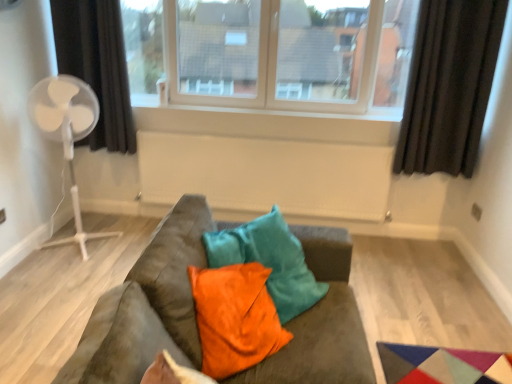
What are the coordinates of `white matte radiator at center` in the screenshot? It's located at (267, 174).

This screenshot has height=384, width=512. In order to click on suede-like brown couch at center in this screenshot , I will do `click(147, 306)`.

Measure the distance between point (130, 296) and camera.

The distance of point (130, 296) from camera is 4.16 feet.

Describe the element at coordinates (97, 66) in the screenshot. I see `black fabric curtain at left, positioned as the 2th curtain in right-to-left order` at that location.

You are a GUI agent. You are given a task and a screenshot of the screen. Output one action in this format:
    pyautogui.click(x=<x>, y=<y>)
    Task: Click on the white plastic window sill at upper center
    The height and width of the screenshot is (384, 512).
    Given the screenshot: What is the action you would take?
    pyautogui.click(x=265, y=123)

Locate an element on the screen. white matte radiator at center is located at coordinates (267, 174).

Considering the sizes of objects black fabric curtain at left, placed as the 1th curtain when sorted from left to right, and suede-like brown couch at center in the image provided, who is smaller, black fabric curtain at left, placed as the 1th curtain when sorted from left to right, or suede-like brown couch at center?

black fabric curtain at left, placed as the 1th curtain when sorted from left to right, is smaller.

Are black fabric curtain at left, placed as the 1th curtain when sorted from left to right, and suede-like brown couch at center making contact?

No, black fabric curtain at left, placed as the 1th curtain when sorted from left to right, is not touching suede-like brown couch at center.

From a real-world perspective, who is located lower, black fabric curtain at left, positioned as the 2th curtain in right-to-left order, or suede-like brown couch at center?

suede-like brown couch at center, from a real-world perspective.

Is black fabric curtain at right, the 1th curtain from the right, inside or outside of orange velvet pillow at center?

black fabric curtain at right, the 1th curtain from the right, is outside orange velvet pillow at center.

Which is closer to the camera, [440,159] or [277,332]?

Point [440,159] is farther from the camera than point [277,332].

Is black fabric curtain at right, the 1th curtain from the right, touching orange velvet pillow at center?

No, black fabric curtain at right, the 1th curtain from the right, is not with orange velvet pillow at center.

Is black fabric curtain at right, the 1th curtain from the right, wider or thinner than orange velvet pillow at center?

Clearly, black fabric curtain at right, the 1th curtain from the right, has less width compared to orange velvet pillow at center.

Is the depth of white matte radiator at center less than that of white plastic fan at left?

No, the depth of white matte radiator at center is greater than that of white plastic fan at left.

Is white matte radiator at center next to white plastic fan at left and touching it?

No.

Is white matte radiator at center aimed at white plastic fan at left?

No, white matte radiator at center is not oriented towards white plastic fan at left.

How different are the orientations of white matte radiator at center and white plastic fan at left in degrees?

white matte radiator at center and white plastic fan at left are facing 0.765 degrees away from each other.

Is white plastic fan at left located outside transparent glass window at center?

Absolutely, white plastic fan at left is external to transparent glass window at center.

Is white plastic fan at left looking in the opposite direction of transparent glass window at center?

No, white plastic fan at left is not facing the opposite direction of transparent glass window at center.

Can you confirm if white plastic fan at left is positioned to the left of transparent glass window at center?

Yes, white plastic fan at left is to the left of transparent glass window at center.

From the picture: Considering the sizes of white plastic fan at left and transparent glass window at center in the image, is white plastic fan at left taller or shorter than transparent glass window at center?

white plastic fan at left is taller than transparent glass window at center.

Is white matte radiator at center far away from black fabric curtain at right, marked as the 2th curtain in a left-to-right arrangement?

That's not correct — white matte radiator at center is a little close to black fabric curtain at right, marked as the 2th curtain in a left-to-right arrangement.

Image resolution: width=512 pixels, height=384 pixels. In order to click on the 2nd curtain in front of the white matte radiator at center, starting your count from the anchor in this screenshot , I will do (x=449, y=86).

Measure the distance between white matte radiator at center and black fabric curtain at right, the 1th curtain from the right.

31.02 inches.

Does white matte radiator at center have a lesser height compared to black fabric curtain at right, the 1th curtain from the right?

Yes.

Which object is more forward, orange velvet pillow at center or white matte radiator at center?

orange velvet pillow at center is more forward.

Can you confirm if orange velvet pillow at center is bigger than white matte radiator at center?

Actually, orange velvet pillow at center might be smaller than white matte radiator at center.

Are orange velvet pillow at center and white matte radiator at center beside each other?

No, orange velvet pillow at center is not next to white matte radiator at center.

Is transparent glass window at center with black fabric curtain at left, positioned as the 2th curtain in right-to-left order?

transparent glass window at center and black fabric curtain at left, positioned as the 2th curtain in right-to-left order, are not in contact.

Looking at the image, does transparent glass window at center seem bigger or smaller compared to black fabric curtain at left, positioned as the 2th curtain in right-to-left order?

transparent glass window at center is bigger than black fabric curtain at left, positioned as the 2th curtain in right-to-left order.

Is transparent glass window at center situated inside black fabric curtain at left, placed as the 1th curtain when sorted from left to right, or outside?

transparent glass window at center is not inside black fabric curtain at left, placed as the 1th curtain when sorted from left to right, it's outside.

Find the location of `studio couch lying on the right of black fabric curtain at left, placed as the 1th curtain when sorted from left to right`. studio couch lying on the right of black fabric curtain at left, placed as the 1th curtain when sorted from left to right is located at coordinates (147, 306).

Which curtain is the 1st one when counting from the back of the orange velvet pillow at center? Please provide its 2D coordinates.

[(449, 86)]

Considering their positions, is white plastic window sill at upper center positioned further to suede-like brown couch at center than black fabric curtain at right, the 1th curtain from the right?

white plastic window sill at upper center is further to suede-like brown couch at center.

Estimate the real-world distances between objects in this image. Which object is closer to orange velvet pillow at center, white plastic window sill at upper center or white plastic fan at left?

white plastic fan at left.

Estimate the real-world distances between objects in this image. Which object is further from suede-like brown couch at center, transparent glass window at center or black fabric curtain at left, positioned as the 2th curtain in right-to-left order?

black fabric curtain at left, positioned as the 2th curtain in right-to-left order, lies further to suede-like brown couch at center than the other object.

Consider the image. Based on their spatial positions, is white matte radiator at center or black fabric curtain at left, placed as the 1th curtain when sorted from left to right, closer to white plastic fan at left?

black fabric curtain at left, placed as the 1th curtain when sorted from left to right, is closer to white plastic fan at left.

Estimate the real-world distances between objects in this image. Which object is closer to transparent glass window at center, white plastic fan at left or black fabric curtain at right, the 1th curtain from the right?

black fabric curtain at right, the 1th curtain from the right, is positioned closer to the anchor transparent glass window at center.

Based on their spatial positions, is white plastic window sill at upper center or white matte radiator at center closer to white plastic fan at left?

Among the two, white plastic window sill at upper center is located nearer to white plastic fan at left.

From the image, which object appears to be farther from black fabric curtain at left, placed as the 1th curtain when sorted from left to right, black fabric curtain at right, marked as the 2th curtain in a left-to-right arrangement, or white plastic window sill at upper center?

Based on the image, black fabric curtain at right, marked as the 2th curtain in a left-to-right arrangement, appears to be further to black fabric curtain at left, placed as the 1th curtain when sorted from left to right.

Based on their spatial positions, is white matte radiator at center or black fabric curtain at left, positioned as the 2th curtain in right-to-left order, closer to black fabric curtain at right, the 1th curtain from the right?

white matte radiator at center.

Find the location of a particular element. The width and height of the screenshot is (512, 384). fan between suede-like brown couch at center and transparent glass window at center from front to back is located at coordinates (66, 133).

The height and width of the screenshot is (384, 512). In order to click on radiator between white plastic fan at left and black fabric curtain at right, marked as the 2th curtain in a left-to-right arrangement, from left to right in this screenshot , I will do [x=267, y=174].

Find the location of a particular element. The height and width of the screenshot is (384, 512). radiator located between suede-like brown couch at center and white plastic window sill at upper center in the depth direction is located at coordinates (267, 174).

Locate an element on the screen. This screenshot has width=512, height=384. window between white plastic fan at left and white matte radiator at center in the horizontal direction is located at coordinates (272, 52).